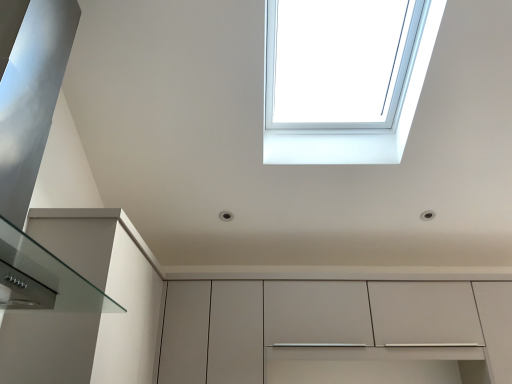
Question: Is transparent glass window at upper center bigger or smaller than matte white cabinet at center?

Choices:
 (A) small
 (B) big

Answer: (A)

Question: In terms of height, does transparent glass window at upper center look taller or shorter compared to matte white cabinet at center?

Choices:
 (A) tall
 (B) short

Answer: (B)

Question: Considering the positions of transparent glass window at upper center and matte white cabinet at center in the image, is transparent glass window at upper center wider or thinner than matte white cabinet at center?

Choices:
 (A) thin
 (B) wide

Answer: (B)

Question: In terms of width, does matte white cabinet at center look wider or thinner when compared to transparent glass window at upper center?

Choices:
 (A) thin
 (B) wide

Answer: (A)

Question: In the image, is matte white cabinet at center on the left side or the right side of transparent glass window at upper center?

Choices:
 (A) left
 (B) right

Answer: (B)

Question: From the image's perspective, relative to transparent glass window at upper center, is matte white cabinet at center above or below?

Choices:
 (A) below
 (B) above

Answer: (A)

Question: In terms of size, does matte white cabinet at center appear bigger or smaller than transparent glass window at upper center?

Choices:
 (A) big
 (B) small

Answer: (A)